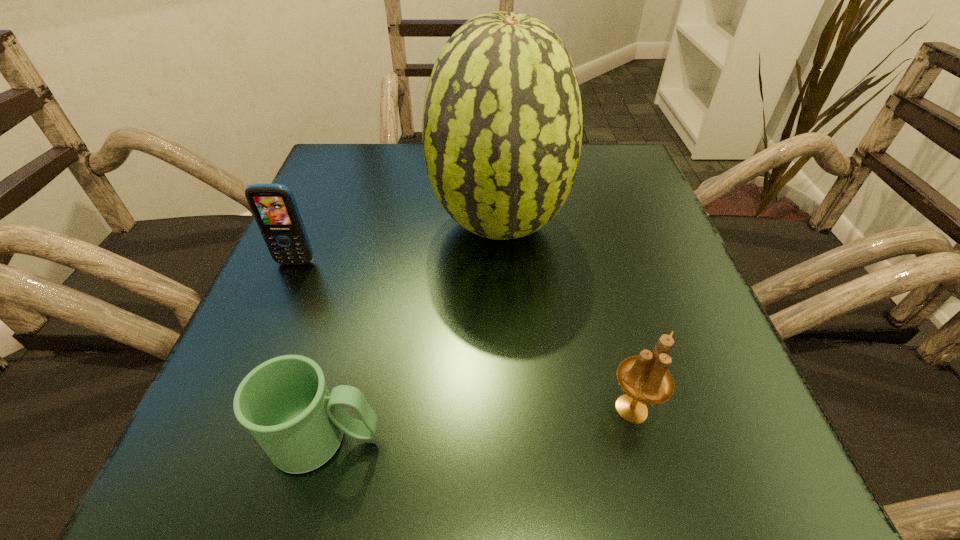
The height and width of the screenshot is (540, 960). In order to click on blank space at the far left corner in this screenshot , I will do `click(385, 168)`.

The width and height of the screenshot is (960, 540). I want to click on vacant region at the far right corner of the desktop, so click(610, 146).

Identify the location of empty location between the candle holder and the cellular telephone. Image resolution: width=960 pixels, height=540 pixels. (464, 336).

Where is `vacant space in between the cellular telephone and the mug`? vacant space in between the cellular telephone and the mug is located at coordinates (311, 351).

The height and width of the screenshot is (540, 960). Find the location of `free space between the third object from right to left and the candle holder`. free space between the third object from right to left and the candle holder is located at coordinates (478, 424).

Where is `vacant space that is in between the candle holder and the watermelon`? vacant space that is in between the candle holder and the watermelon is located at coordinates (565, 316).

Find the location of a particular element. The image size is (960, 540). vacant space that's between the shortest object and the candle holder is located at coordinates tap(478, 424).

Locate an element on the screen. Image resolution: width=960 pixels, height=540 pixels. vacant point located between the cellular telephone and the candle holder is located at coordinates (464, 336).

You are a GUI agent. You are given a task and a screenshot of the screen. Output one action in this format:
    pyautogui.click(x=<x>, y=<y>)
    Task: Click on the free space that is in between the watermelon and the mug
    This screenshot has height=540, width=960.
    Given the screenshot: What is the action you would take?
    pyautogui.click(x=412, y=332)

The image size is (960, 540). Find the location of `free spot between the candle holder and the leftmost object`. free spot between the candle holder and the leftmost object is located at coordinates (464, 336).